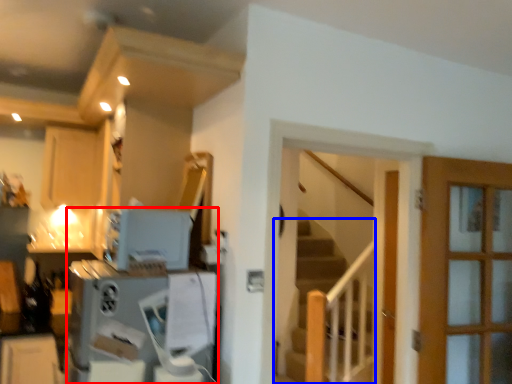
Question: Which of the following is the farthest to the observer, appliance (highlighted by a red box) or stairs (highlighted by a blue box)?

Choices:
 (A) appliance
 (B) stairs

Answer: (B)